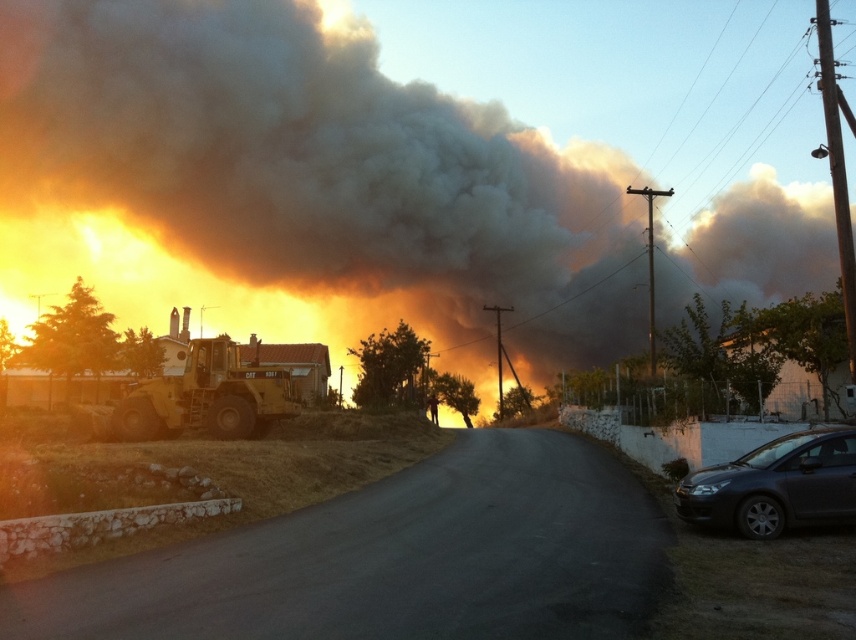
You are a firefighter trying to reach the fire at the base of the smoke plume. You are currently at point (242, 227). There is an obstacle at point (685, 502). Can you safely navigate around the obstacle to reach the fire?

Point (242, 227) is behind point (685, 502), so you are already behind the obstacle. You can safely navigate around it to reach the fire.

You are a firefighter assessing the scene from the road. You see the black smoke at upper center and the dark gray metallic car at lower right. Which object is higher in the image?

The black smoke at upper center is higher in the image than the dark gray metallic car at lower right.

You are a firefighter trying to locate the source of the fire. You see the black smoke at upper center in the image. Based on its position, can you estimate where the fire is most likely located relative to the road and the small building with a red roof?

The black smoke at upper center is located at coordinates approximately 0.263 on the x axis and 0.480 on the y axis, which suggests the fire is near the small building with a red roof on the left side of the road.